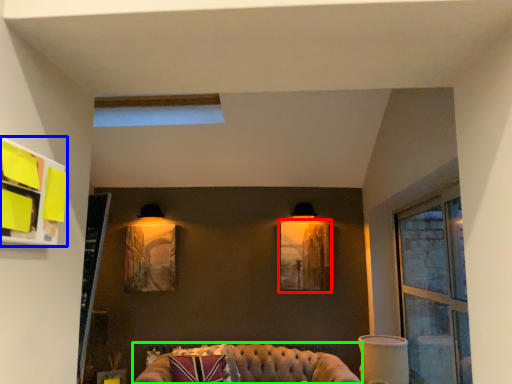
Question: Which object is the closest to the picture frame (highlighted by a red box)? Choose among these: shelf (highlighted by a blue box) or studio couch (highlighted by a green box).

Choices:
 (A) shelf
 (B) studio couch

Answer: (B)